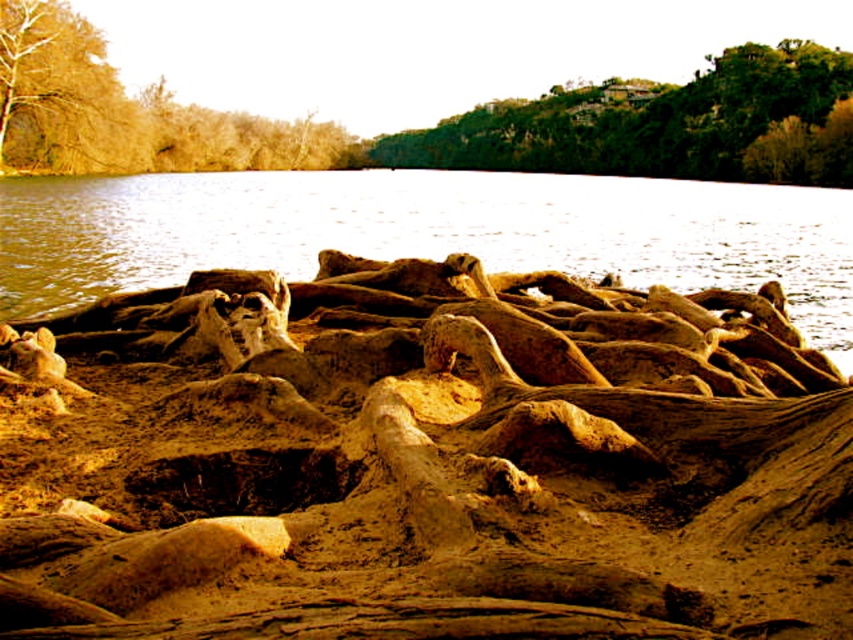
Can you confirm if brown textured sand at center is thinner than brown water at center?

Yes, brown textured sand at center is thinner than brown water at center.

Which is above, brown textured sand at center or brown water at center?

brown water at center

Describe the element at coordinates (419, 467) in the screenshot. I see `brown textured sand at center` at that location.

This screenshot has height=640, width=853. I want to click on brown textured sand at center, so click(x=419, y=467).

Is brown water at center below brown textured tree at upper left?

Indeed, brown water at center is positioned under brown textured tree at upper left.

Is brown water at center thinner than brown textured tree at upper left?

Incorrect, brown water at center's width is not less than brown textured tree at upper left's.

Between point (131, 248) and point (26, 156), which one is positioned behind?

Positioned behind is point (26, 156).

I want to click on brown water at center, so [x=428, y=232].

Does green leafy tree at upper center have a smaller size compared to brown textured tree at upper left?

No, green leafy tree at upper center is not smaller than brown textured tree at upper left.

You are a GUI agent. You are given a task and a screenshot of the screen. Output one action in this format:
    pyautogui.click(x=<x>, y=<y>)
    Task: Click on the green leafy tree at upper center
    This screenshot has width=853, height=640.
    Given the screenshot: What is the action you would take?
    pyautogui.click(x=664, y=124)

At what (x,y) coordinates should I click in order to perform the action: click on green leafy tree at upper center. Please return your answer as a coordinate pair (x, y). The width and height of the screenshot is (853, 640). Looking at the image, I should click on (664, 124).